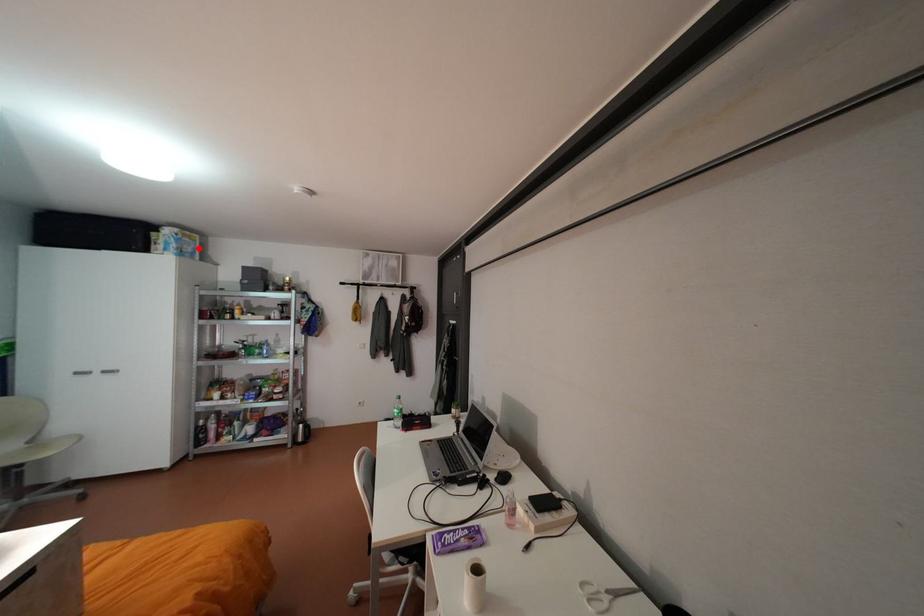
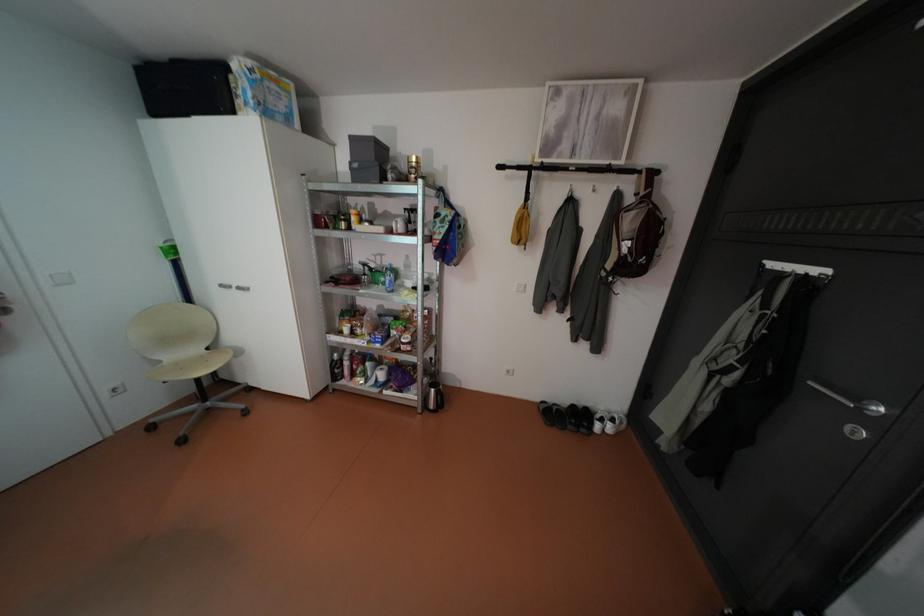
The point at the highlighted location is marked in the first image. Where is the corresponding point in the second image?

(290, 107)